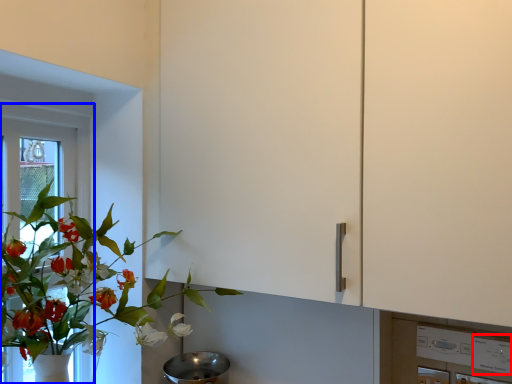
Question: Which object appears closest to the camera in this image, appliance (highlighted by a red box) or window frame (highlighted by a blue box)?

Choices:
 (A) appliance
 (B) window frame

Answer: (A)